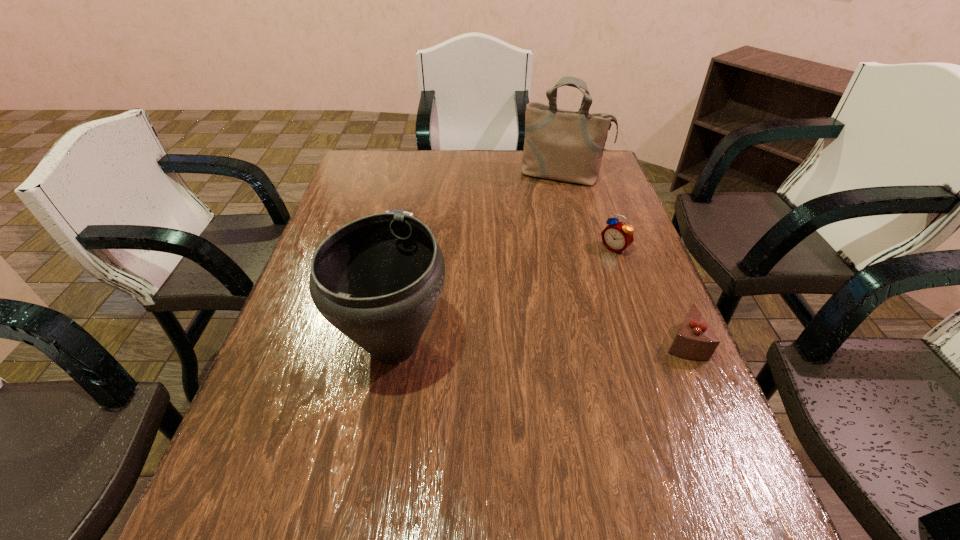
You are a GUI agent. You are given a task and a screenshot of the screen. Output one action in this format:
    pyautogui.click(x=<x>, y=<y>)
    Task: Click on the empty location between the second shortest object and the alarm clock
    
    Given the screenshot: What is the action you would take?
    pyautogui.click(x=648, y=295)

Identify the location of object that is the closest one to the second tallest object. point(397,211).

Where is `the fourth closest object to the fourth tallest object`? the fourth closest object to the fourth tallest object is located at coordinates [397, 211].

Locate an element on the screen. The height and width of the screenshot is (540, 960). vacant point that satisfies the following two spatial constraints: 1. on the front side of the chocolate cake; 2. on the left side of the tallest object is located at coordinates (609, 341).

Locate an element on the screen. vacant position in the image that satisfies the following two spatial constraints: 1. on the front side of the fourth tallest object; 2. on the left side of the shortest object is located at coordinates (356, 341).

At what (x,y) coordinates should I click in order to perform the action: click on vacant space that satisfies the following two spatial constraints: 1. on the front side of the fourth tallest object; 2. on the right side of the alarm clock. Please return your answer as a coordinate pair (x, y). Looking at the image, I should click on (647, 341).

Identify the location of free point that satisfies the following two spatial constraints: 1. on the front side of the shortest object; 2. on the right side of the chocolate cake. The width and height of the screenshot is (960, 540). click(x=356, y=341).

Identify the location of free space in the image that satisfies the following two spatial constraints: 1. on the front side of the urn; 2. on the left side of the shortest object. (355, 346).

Locate an element on the screen. This screenshot has height=540, width=960. vacant area in the image that satisfies the following two spatial constraints: 1. on the front side of the alarm clock; 2. on the right side of the shortest object is located at coordinates (380, 248).